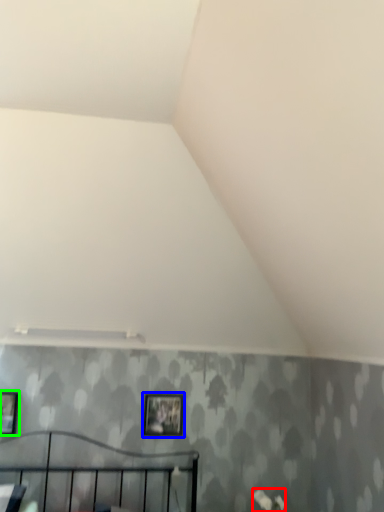
Question: Which object is the farthest from flower (highlighted by a red box)? Choose among these: picture frame (highlighted by a blue box) or picture frame (highlighted by a green box).

Choices:
 (A) picture frame
 (B) picture frame

Answer: (B)